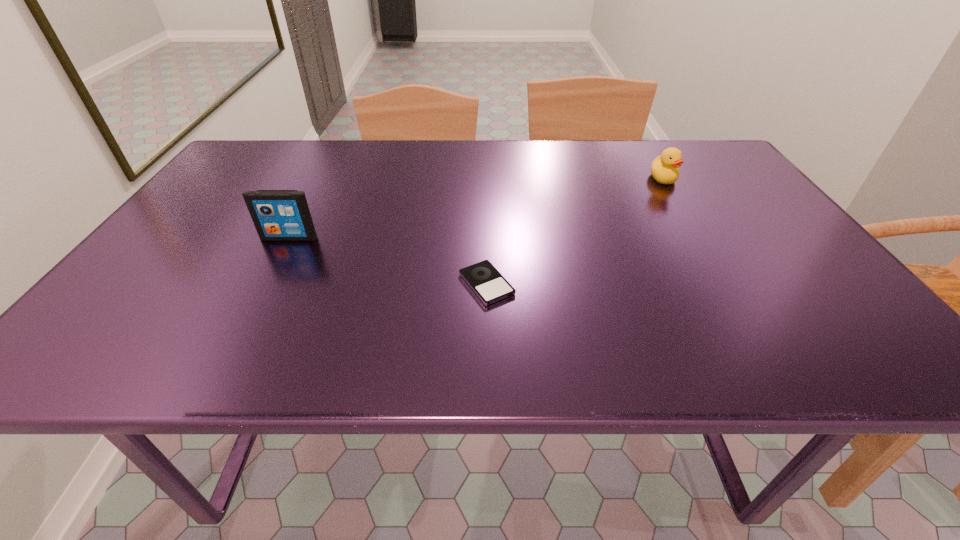
Image resolution: width=960 pixels, height=540 pixels. Identify the location of vacant space that's between the taller iPod and the second tallest object. (476, 208).

Where is `free area in between the nearest object and the left iPod`? The width and height of the screenshot is (960, 540). free area in between the nearest object and the left iPod is located at coordinates (388, 261).

Image resolution: width=960 pixels, height=540 pixels. In order to click on free point between the rightmost object and the leftmost object in this screenshot , I will do pyautogui.click(x=476, y=208).

In order to click on vacant area between the second tallest object and the right iPod in this screenshot , I will do `click(575, 231)`.

The width and height of the screenshot is (960, 540). I want to click on empty space that is in between the farthest object and the leftmost object, so click(476, 208).

What are the coordinates of `free space between the duck and the tallest object` in the screenshot? It's located at (476, 208).

Where is `object that can be found as the second closest to the nearer iPod`? object that can be found as the second closest to the nearer iPod is located at coordinates (664, 168).

Where is `object that stands as the closest to the leftmost object`? object that stands as the closest to the leftmost object is located at coordinates (484, 279).

The image size is (960, 540). In order to click on vacant space that satisfies the following two spatial constraints: 1. on the front screen of the left iPod; 2. on the right side of the right iPod in this screenshot , I will do `click(265, 284)`.

You are a GUI agent. You are given a task and a screenshot of the screen. Output one action in this format:
    pyautogui.click(x=<x>, y=<y>)
    Task: Click on the vacant space that satisfies the following two spatial constraints: 1. on the front screen of the nearer iPod; 2. on the right side of the left iPod
    
    Given the screenshot: What is the action you would take?
    pyautogui.click(x=265, y=284)